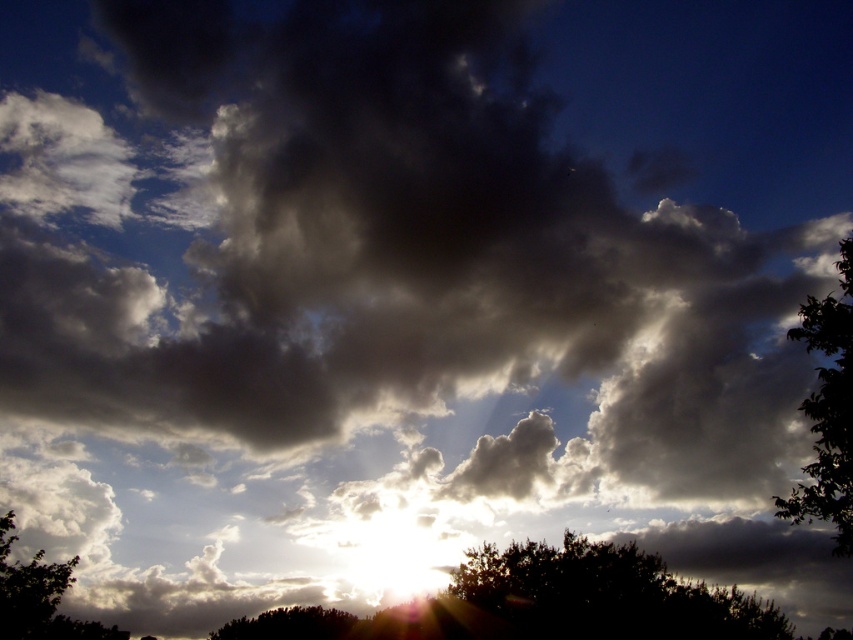
You are standing in a field and see a dark green leafy tree at right and a green leafy tree at lower left. Which tree is located to the right of the other?

The dark green leafy tree at right is positioned on the right side of green leafy tree at lower left.

You are an architect designing a new park and want to place a bench between the dark green leafy tree at right and the dark green leafy tree at lower center. Which tree should the bench be closer to if you want it to be proportionally sized to the smaller tree?

The bench should be closer to the dark green leafy tree at lower center because it is smaller in size compared to the dark green leafy tree at right.